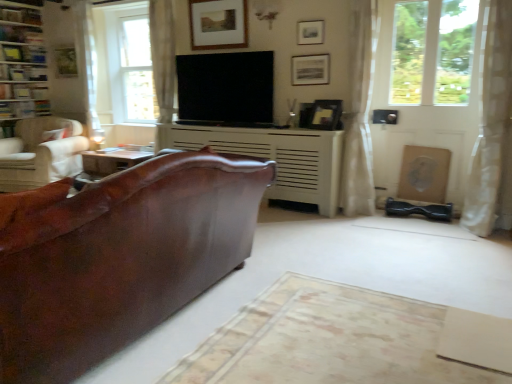
The width and height of the screenshot is (512, 384). Find the location of `vacant area that lies between white textured curtain at right, placed as the second curtain when sorted from left to right, and brown leather couch at center`. vacant area that lies between white textured curtain at right, placed as the second curtain when sorted from left to right, and brown leather couch at center is located at coordinates (348, 274).